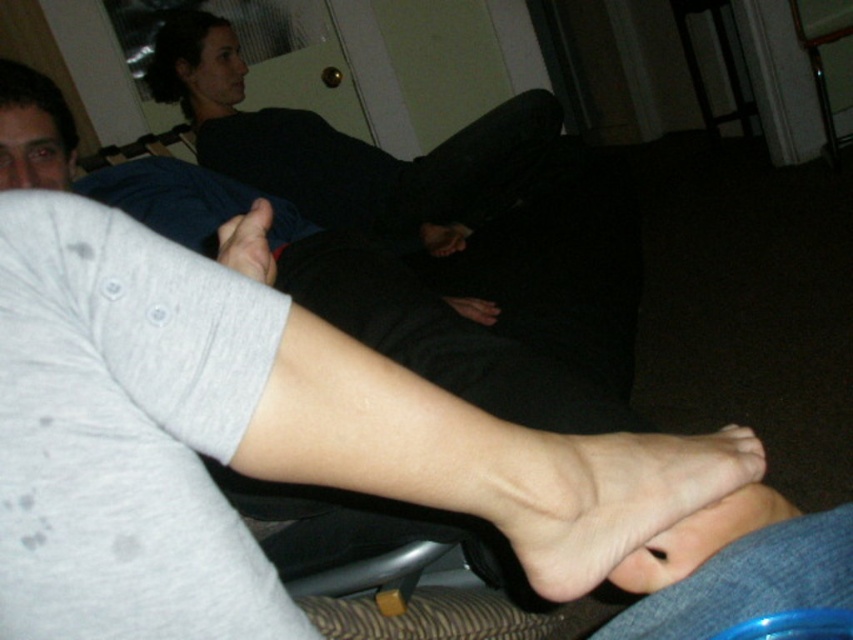
Question: From the image, what is the correct spatial relationship of smooth black pants at upper center in relation to skinny white foot at lower center?

Choices:
 (A) above
 (B) below

Answer: (A)

Question: Which is nearer to the skinny white foot at lower center?

Choices:
 (A) smooth skin foot at lower center
 (B) matte skin toe at center

Answer: (A)

Question: Is smooth black pants at upper center smaller than matte skin toe at center?

Choices:
 (A) yes
 (B) no

Answer: (B)

Question: Is smooth black pants at upper center wider than skinny white foot at lower center?

Choices:
 (A) no
 (B) yes

Answer: (B)

Question: Which point appears closest to the camera in this image?

Choices:
 (A) (317, 145)
 (B) (541, 577)
 (C) (734, 522)

Answer: (B)

Question: Which object is closer to the camera taking this photo?

Choices:
 (A) smooth black pants at upper center
 (B) smooth skin foot at lower center
 (C) matte skin toe at center

Answer: (B)